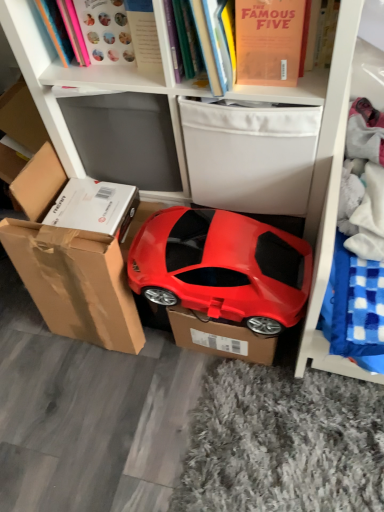
Question: Should I look upward or downward to see glossy plastic car at center?

Choices:
 (A) up
 (B) down

Answer: (B)

Question: Is white fabric storage box at upper center next to brown cardboard box at lower left and touching it?

Choices:
 (A) no
 (B) yes

Answer: (A)

Question: Is white fabric storage box at upper center smaller than brown cardboard box at lower left?

Choices:
 (A) no
 (B) yes

Answer: (A)

Question: Is white fabric storage box at upper center bigger than brown cardboard box at lower left?

Choices:
 (A) yes
 (B) no

Answer: (A)

Question: Considering the relative positions of white fabric storage box at upper center and brown cardboard box at lower left in the image provided, is white fabric storage box at upper center in front of brown cardboard box at lower left?

Choices:
 (A) no
 (B) yes

Answer: (B)

Question: Does white fabric storage box at upper center have a lesser width compared to brown cardboard box at lower left?

Choices:
 (A) yes
 (B) no

Answer: (B)

Question: From the image's perspective, is white fabric storage box at upper center above brown cardboard box at lower left?

Choices:
 (A) no
 (B) yes

Answer: (B)

Question: Is matte pink book at upper left, which appears as the third book when viewed from the right, inside matte orange book at upper center, the 1th book positioned from the right?

Choices:
 (A) yes
 (B) no

Answer: (B)

Question: Would you say matte orange book at upper center, which is the 3th book from left to right, is outside matte pink book at upper left, the 1th book when ordered from left to right?

Choices:
 (A) no
 (B) yes

Answer: (B)

Question: From a real-world perspective, does matte orange book at upper center, which is the 3th book from left to right, sit lower than matte pink book at upper left, the 1th book when ordered from left to right?

Choices:
 (A) yes
 (B) no

Answer: (A)

Question: Is matte orange book at upper center, which is the 3th book from left to right, turned away from matte pink book at upper left, which appears as the third book when viewed from the right?

Choices:
 (A) no
 (B) yes

Answer: (A)

Question: Is matte orange book at upper center, the 1th book positioned from the right, positioned behind matte pink book at upper left, the 1th book when ordered from left to right?

Choices:
 (A) no
 (B) yes

Answer: (A)

Question: From the image's perspective, would you say matte orange book at upper center, which is the 3th book from left to right, is shown under matte pink book at upper left, which appears as the third book when viewed from the right?

Choices:
 (A) yes
 (B) no

Answer: (A)

Question: Can you confirm if hardcover book at upper center, the 2th book in the left-to-right sequence, is smaller than matte pink book at upper left, the 1th book when ordered from left to right?

Choices:
 (A) no
 (B) yes

Answer: (A)